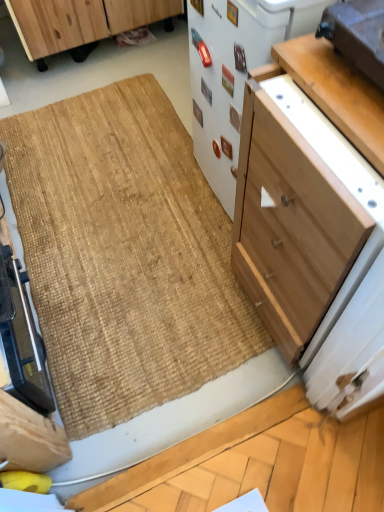
Question: Can you confirm if light wood cabinet at center-right, positioned as the first cabinetry in front-to-back order, is thinner than light brown wood drawer at upper right?

Choices:
 (A) yes
 (B) no

Answer: (B)

Question: Is light wood cabinet at center-right, which is the 2th cabinetry from back to front, bigger than light brown wood drawer at upper right?

Choices:
 (A) no
 (B) yes

Answer: (B)

Question: Is light wood cabinet at center-right, acting as the 1th cabinetry starting from the bottom, further to the viewer compared to light brown wood drawer at upper right?

Choices:
 (A) yes
 (B) no

Answer: (B)

Question: Is light wood cabinet at center-right, which is the 2th cabinetry from back to front, surrounding light brown wood drawer at upper right?

Choices:
 (A) yes
 (B) no

Answer: (B)

Question: Is light wood cabinet at center-right, which is the 2th cabinetry from back to front, at the left side of light brown wood drawer at upper right?

Choices:
 (A) yes
 (B) no

Answer: (B)

Question: From a real-world perspective, is light wood cabinet at center-right, which is the 2th cabinetry from back to front, positioned under light brown wood drawer at upper right based on gravity?

Choices:
 (A) yes
 (B) no

Answer: (A)

Question: Is wooden cabinet at upper left, the 1th cabinetry viewed from the top, next to natural fiber doormat at center and touching it?

Choices:
 (A) yes
 (B) no

Answer: (B)

Question: Is wooden cabinet at upper left, positioned as the first cabinetry in left-to-right order, shorter than natural fiber doormat at center?

Choices:
 (A) yes
 (B) no

Answer: (B)

Question: Is wooden cabinet at upper left, positioned as the first cabinetry in left-to-right order, behind natural fiber doormat at center?

Choices:
 (A) no
 (B) yes

Answer: (B)

Question: Could natural fiber doormat at center be considered to be inside wooden cabinet at upper left, the 2th cabinetry in the front-to-back sequence?

Choices:
 (A) no
 (B) yes

Answer: (A)

Question: From a real-world perspective, is wooden cabinet at upper left, the second cabinetry viewed from the right, positioned over natural fiber doormat at center based on gravity?

Choices:
 (A) no
 (B) yes

Answer: (B)

Question: Considering the relative sizes of wooden cabinet at upper left, the 2th cabinetry in the front-to-back sequence, and natural fiber doormat at center in the image provided, is wooden cabinet at upper left, the 2th cabinetry in the front-to-back sequence, smaller than natural fiber doormat at center?

Choices:
 (A) yes
 (B) no

Answer: (B)

Question: Is white matte refrigerator at center, acting as the second appliance starting from the right, thinner than natural fiber doormat at center?

Choices:
 (A) yes
 (B) no

Answer: (A)